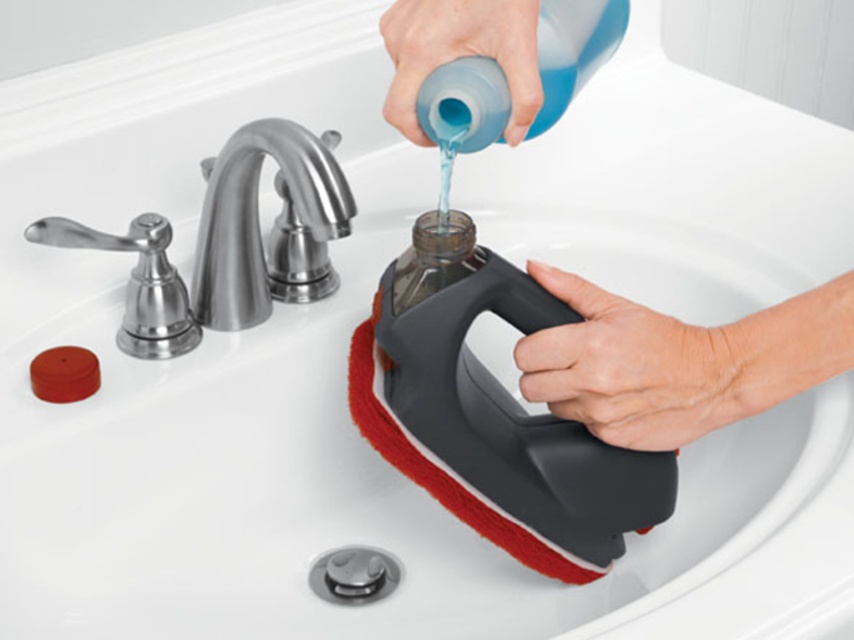
You are trying to pour cleaning solution into the scrubber. The scrubber is located between the brushed metal faucet at upper center and the blue rubber glove at upper center. Can you pour the liquid without hitting either object?

The brushed metal faucet at upper center is positioned on the left side of blue rubber glove at upper center. Since the scrubber is between them, you can pour the liquid into the scrubber without hitting either object as they are aligned from left to right.

You are trying to pour the cleaning solution into the scrubber. Which object is closer to your hand holding the bottle? The brushed metal faucet at upper center or the blue rubber glove at upper center?

The blue rubber glove at upper center is closer to your hand holding the bottle because the brushed metal faucet at upper center is positioned below it.